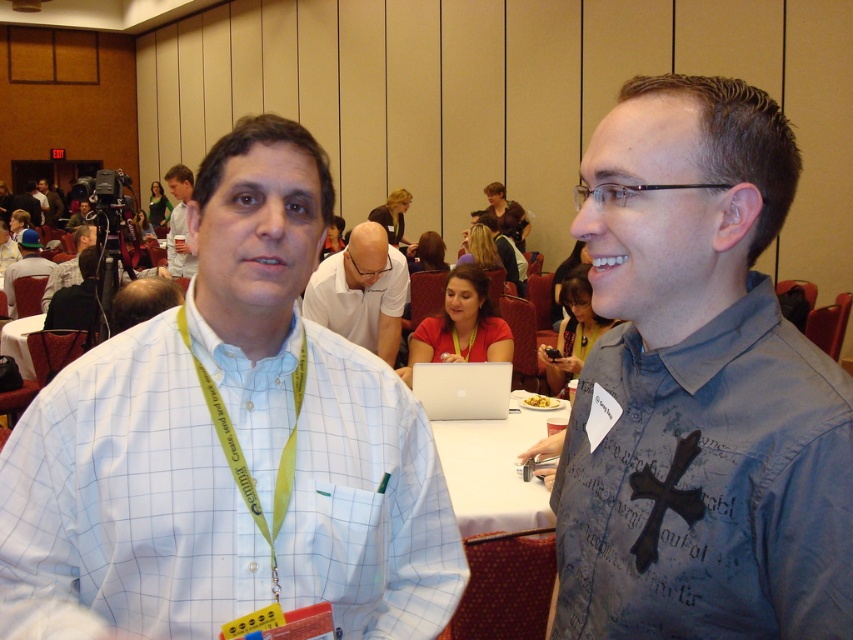
You are setting up equipment for a photo shoot in the conference room. You have a matte black chair at left and a matte black camera at left. Which object should you move if you need to make space for a larger tripod that requires more room near the left side?

You should move the matte black chair at left because it has a smaller size compared to the matte black camera at left, so removing it would free up more space for the tripod.